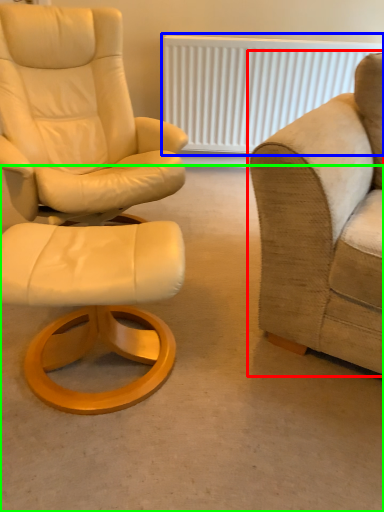
Question: Based on their relative distances, which object is nearer to studio couch (highlighted by a red box)? Choose from radiator (highlighted by a blue box) and concrete (highlighted by a green box).

Choices:
 (A) radiator
 (B) concrete

Answer: (B)